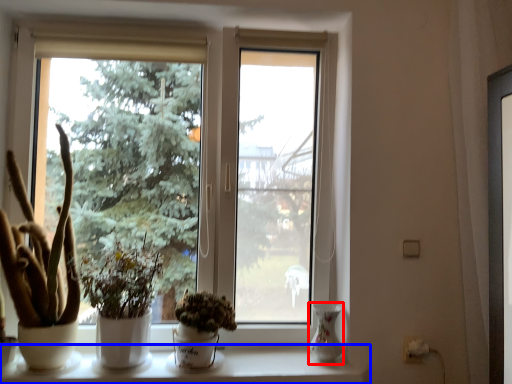
Question: Which point is further to the camera, glass vase (highlighted by a red box) or window sill (highlighted by a blue box)?

Choices:
 (A) glass vase
 (B) window sill

Answer: (A)